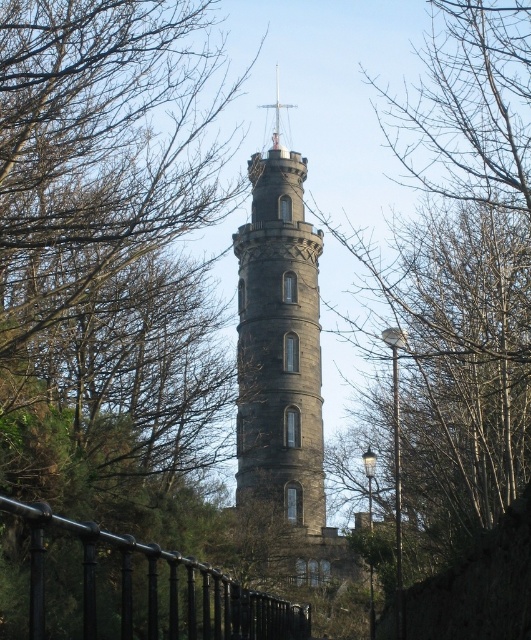
You are standing in the natural setting around the tower and want to reach the point marked as point (264, 294). However, there is an obstacle at point (121, 568). Can you walk directly to your destination without going around the obstacle?

Point (264, 294) is behind point (121, 568), so you cannot walk directly to point (264, 294) without going around the obstacle at point (121, 568).

You are standing in a natural setting with leafless trees around you. You see a point marked at coordinates (278, 371). What does this point indicate?

The point at coordinates (278, 371) indicates the dark stone tower at center.

Based on the photo, you are standing at the lower left corner of the image and want to walk towards the dark stone tower at center. Which direction should you move relative to the black metal fence at lower left?

You should move to the right side of the black metal fence at lower left to reach the dark stone tower at center since the dark stone tower at center is positioned on the right side of the black metal fence at lower left.